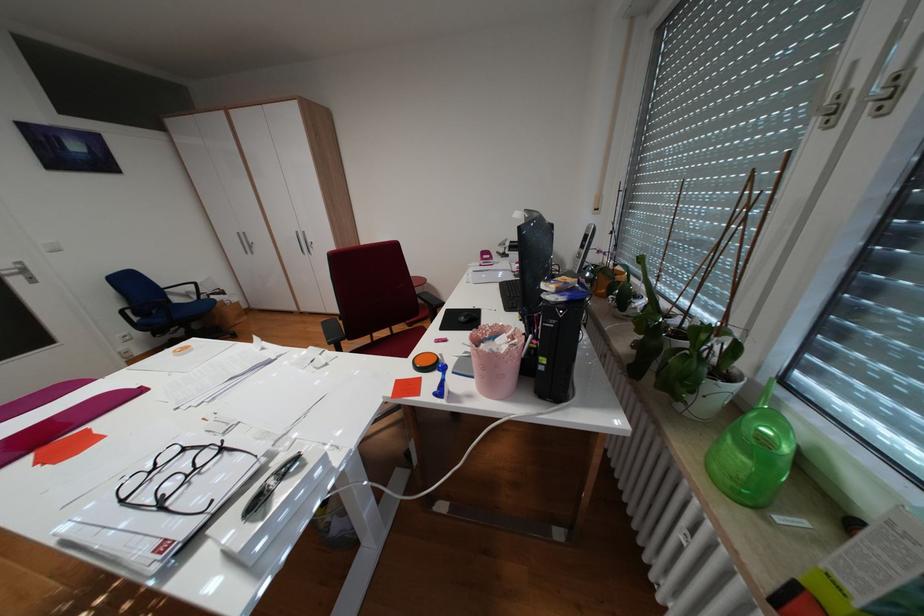
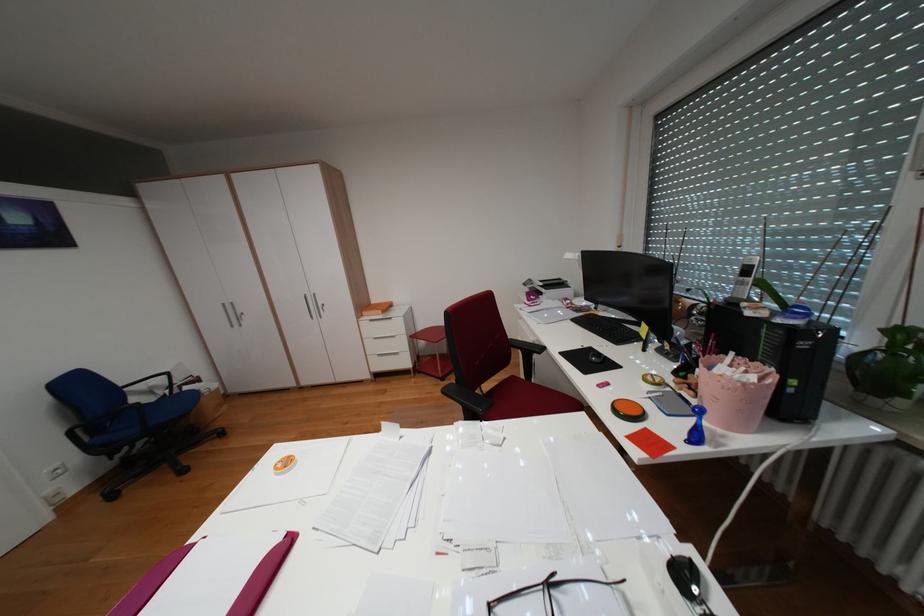
Question: How did the camera likely rotate?

Choices:
 (A) Left
 (B) Right
 (C) Up
 (D) Down

Answer: (B)